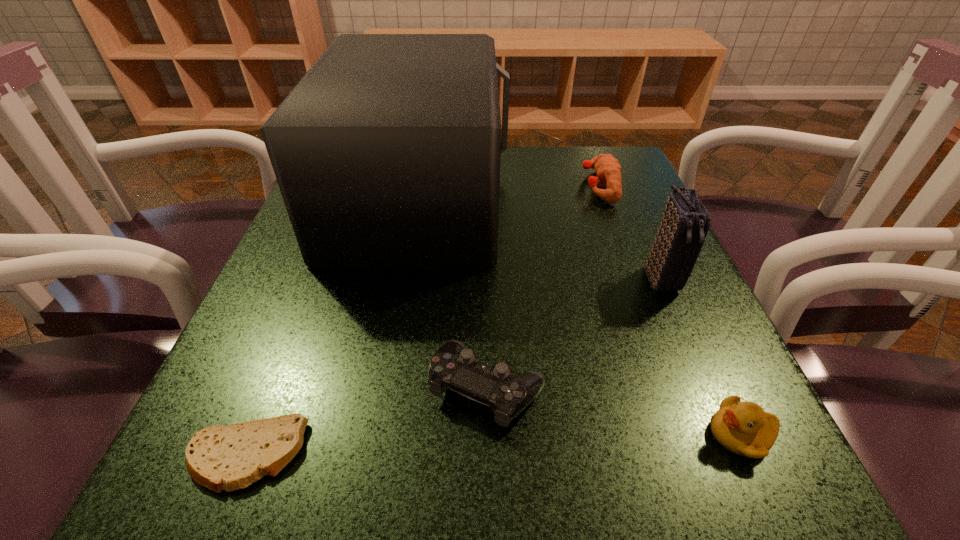
What are the coordinates of `vacant area that lies between the control and the duckling` in the screenshot? It's located at [x=613, y=411].

Image resolution: width=960 pixels, height=540 pixels. What are the coordinates of `unoccupied area between the microwave oven and the shortest object` in the screenshot? It's located at (333, 327).

Find the location of a particular element. unoccupied position between the duckling and the puncher is located at coordinates (669, 310).

Identify which object is located as the second nearest to the pita bread. Please provide its 2D coordinates. Your answer should be formatted as a tuple, i.e. [(x, y)], where the tuple contains the x and y coordinates of a point satisfying the conditions above.

[(387, 152)]

Select which object appears as the second closest to the puncher. Please provide its 2D coordinates. Your answer should be formatted as a tuple, i.e. [(x, y)], where the tuple contains the x and y coordinates of a point satisfying the conditions above.

[(387, 152)]

Identify the location of vacant point that satisfies the following two spatial constraints: 1. on the front-facing side of the control; 2. on the left side of the tallest object. This screenshot has height=540, width=960. (385, 388).

The height and width of the screenshot is (540, 960). What are the coordinates of `vacant region that satisfies the following two spatial constraints: 1. at the beak of the duckling; 2. on the front side of the shortest object` in the screenshot? It's located at (750, 455).